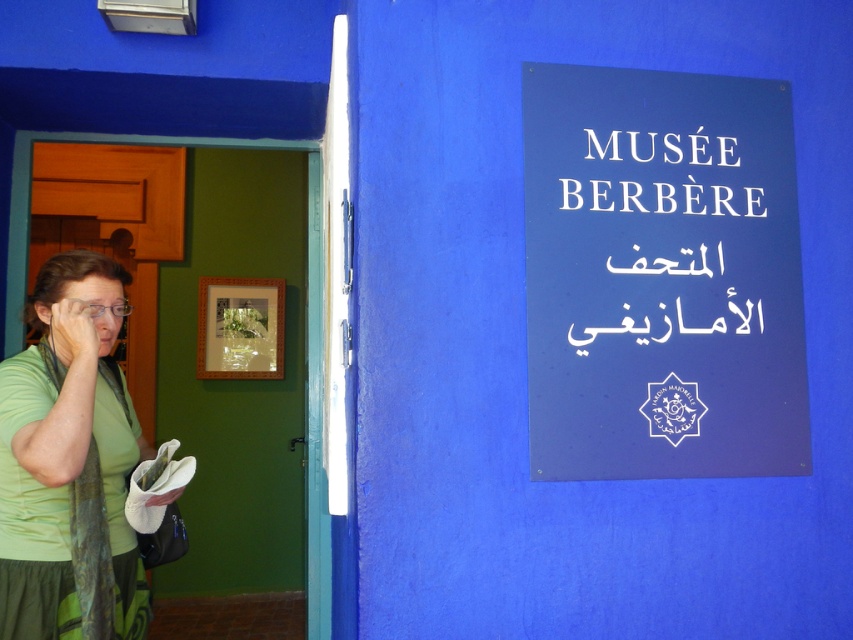
You are standing outside the Mus?e Berb?re museum and notice two items in the scene. One is the green fabric scarf at left and the other is the white plastic sign at upper right. Which of these two items is larger in size?

The green fabric scarf at left is bigger than the white plastic sign at upper right.

From the picture: You are standing outside the Mus??e Berb?re museum entrance and want to read both the blue plastic sign at upper right and the white plastic sign at upper right. Which sign is located below the other?

The blue plastic sign at upper right is positioned under the white plastic sign at upper right, so the blue one is below the white one.

You are standing at the entrance of the Mus?e Berb?re and notice two items, the blue plastic sign at upper right and the green fabric scarf at left. Which one is shorter in height?

→ The blue plastic sign at upper right has a lesser height compared to the green fabric scarf at left, so the blue plastic sign at upper right is shorter.